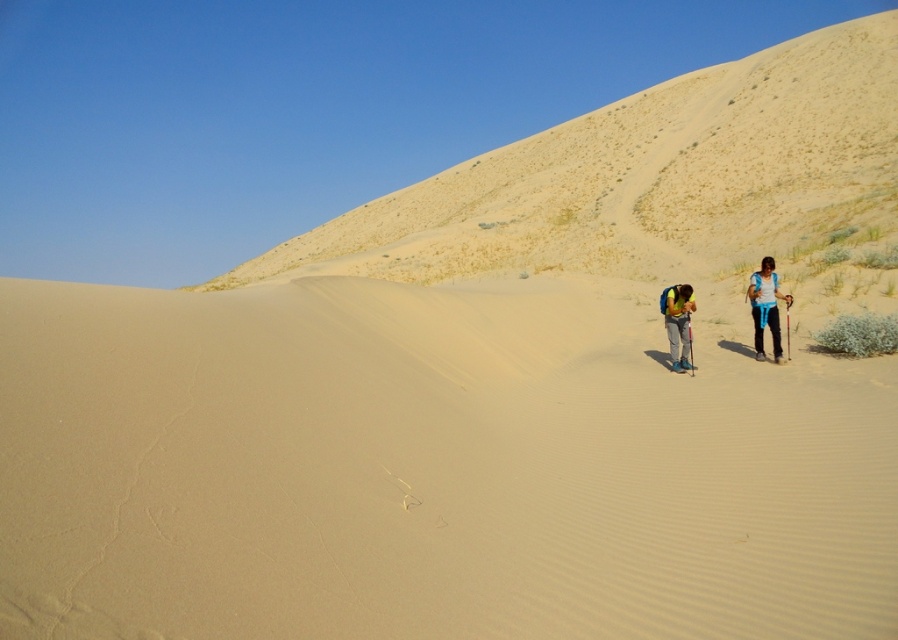
Question: Which object is positioned closest to the smooth sand dune at upper center?

Choices:
 (A) yellow backpack at center
 (B) smooth sand dune at center
 (C) blue fabric backpack at right

Answer: (B)

Question: Which object is the closest to the smooth sand dune at center?

Choices:
 (A) blue fabric backpack at right
 (B) smooth sand dune at upper center
 (C) yellow backpack at center

Answer: (C)

Question: In this image, where is blue fabric backpack at right located relative to yellow backpack at center?

Choices:
 (A) right
 (B) left

Answer: (A)

Question: Among these points, which one is nearest to the camera?

Choices:
 (A) (764, 269)
 (B) (204, 548)
 (C) (679, 324)

Answer: (B)

Question: Is smooth sand dune at center positioned before smooth sand dune at upper center?

Choices:
 (A) yes
 (B) no

Answer: (A)

Question: Does smooth sand dune at upper center appear under blue fabric backpack at right?

Choices:
 (A) no
 (B) yes

Answer: (A)